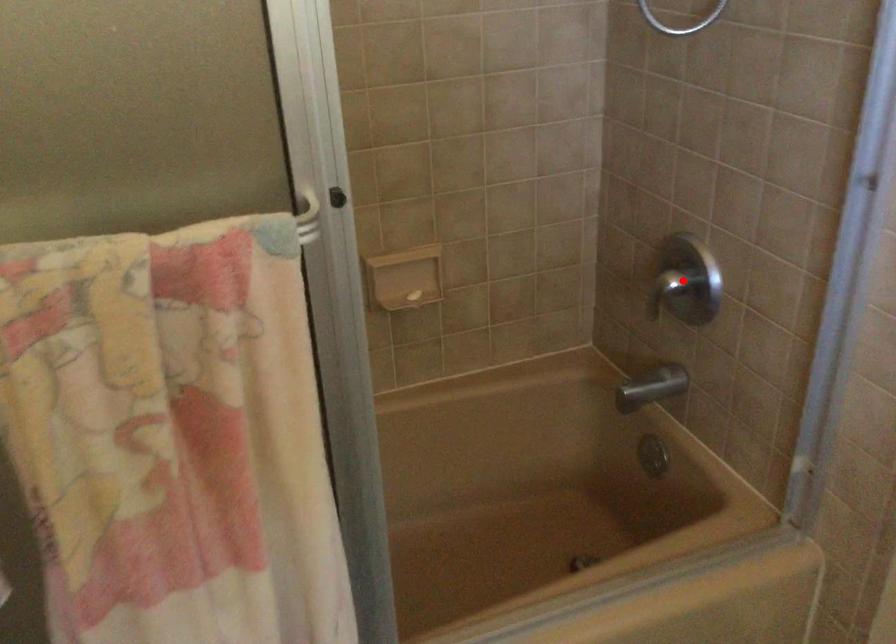
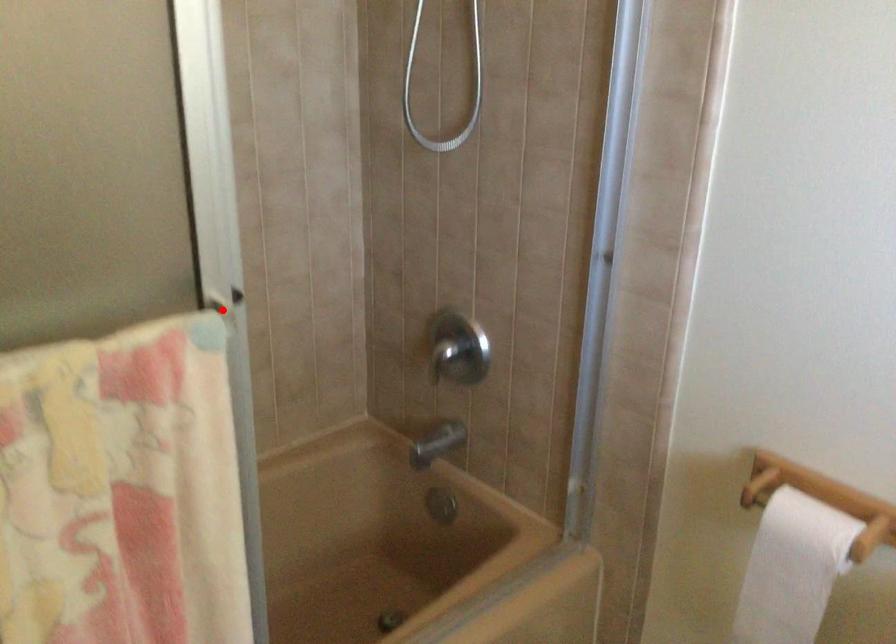
I am providing you with two images of the same scene from different viewpoints. A red point is marked on the first image and another point is marked on the second image. Do the highlighted points in image1 and image2 indicate the same real-world spot?

No